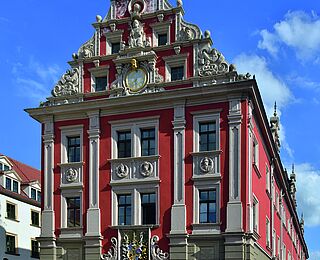
This screenshot has height=260, width=320. In order to click on clock in this screenshot , I will do `click(128, 77)`.